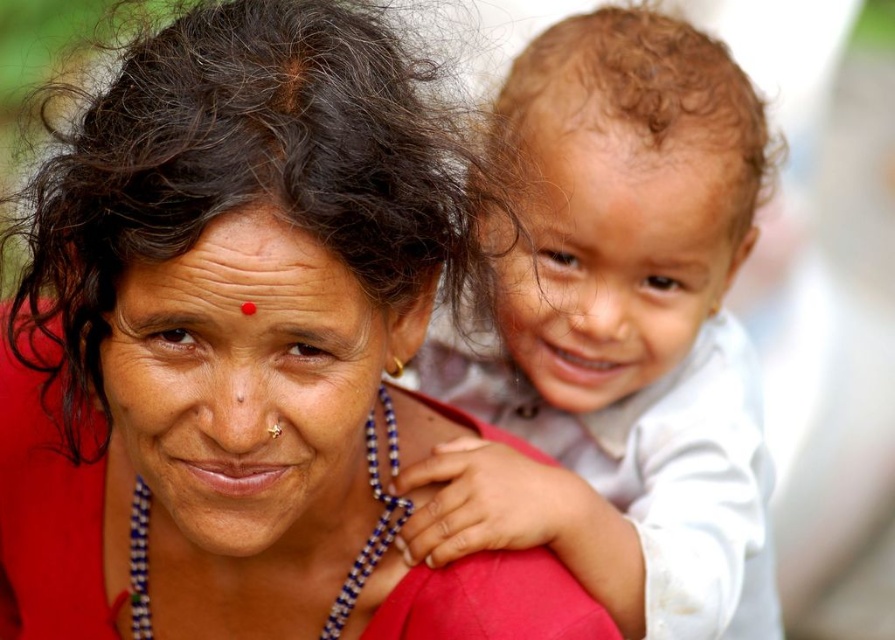
Question: Is dark brown curly hair at upper right to the right of blue beaded necklace at center from the viewer's perspective?

Choices:
 (A) yes
 (B) no

Answer: (B)

Question: Can you confirm if dark brown curly hair at upper right is smaller than blue beaded necklace at center?

Choices:
 (A) yes
 (B) no

Answer: (B)

Question: Which object appears farthest from the camera in this image?

Choices:
 (A) blue beaded necklace at center
 (B) smooth white shirt at right

Answer: (A)

Question: Which point is closer to the camera taking this photo?

Choices:
 (A) (146, 506)
 (B) (72, 294)

Answer: (B)

Question: Estimate the real-world distances between objects in this image. Which object is closer to the blue beaded necklace at center?

Choices:
 (A) dark brown curly hair at upper right
 (B) smooth white shirt at right

Answer: (A)

Question: Is smooth white shirt at right smaller than blue beaded necklace at center?

Choices:
 (A) no
 (B) yes

Answer: (A)